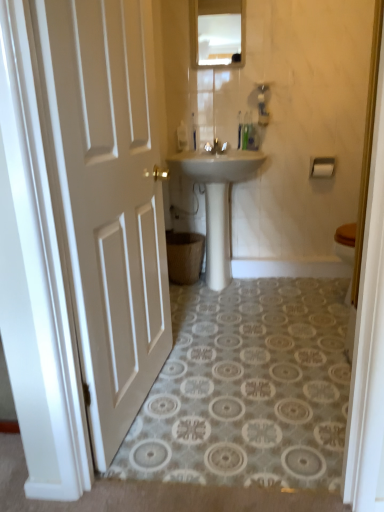
Question: Is white glossy sink at center situated inside glossy glass mirror at upper center or outside?

Choices:
 (A) outside
 (B) inside

Answer: (A)

Question: Considering the positions of white glossy sink at center and glossy glass mirror at upper center in the image, is white glossy sink at center wider or thinner than glossy glass mirror at upper center?

Choices:
 (A) thin
 (B) wide

Answer: (B)

Question: Considering the real-world distances, which object is farthest from the glossy glass mirror at upper center?

Choices:
 (A) white matte toilet paper at right
 (B) white glossy sink at center
 (C) matte white faucet at center
 (D) white matte door at left

Answer: (D)

Question: Which object is the farthest from the matte white faucet at center?

Choices:
 (A) white matte toilet paper at right
 (B) glossy glass mirror at upper center
 (C) white glossy sink at center
 (D) white matte door at left

Answer: (D)